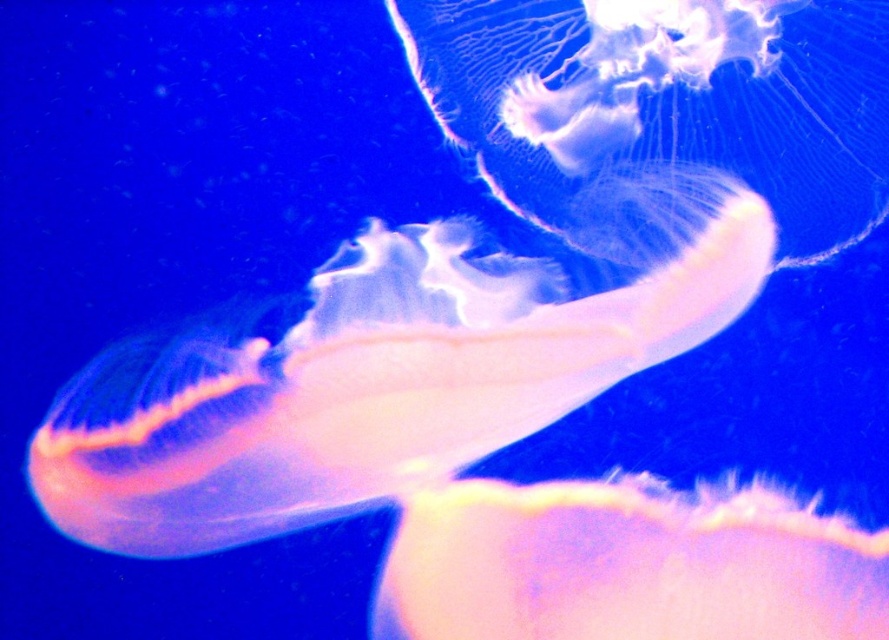
Is translucent white jellyfish at center behind translucent pink jellyfish at center?

No, it is in front of translucent pink jellyfish at center.

This screenshot has width=889, height=640. Find the location of `translucent white jellyfish at center`. translucent white jellyfish at center is located at coordinates (375, 376).

Who is positioned more to the right, translucent white jellyfish at center or translucent white jellyfish at upper center?

From the viewer's perspective, translucent white jellyfish at upper center appears more on the right side.

Is translucent white jellyfish at center shorter than translucent white jellyfish at upper center?

No.

Who is more forward, (325, 310) or (710, 22)?

Point (325, 310) is in front.

Find the location of a particular element. This screenshot has width=889, height=640. translucent white jellyfish at center is located at coordinates (375, 376).

Which is behind, point (526, 26) or point (882, 573)?

Point (526, 26)

Is translucent white jellyfish at upper center to the left of translucent pink jellyfish at center from the viewer's perspective?

Incorrect, translucent white jellyfish at upper center is not on the left side of translucent pink jellyfish at center.

Identify the location of translucent white jellyfish at upper center. This screenshot has width=889, height=640. (663, 100).

Where is `translucent white jellyfish at upper center`? This screenshot has width=889, height=640. translucent white jellyfish at upper center is located at coordinates (663, 100).